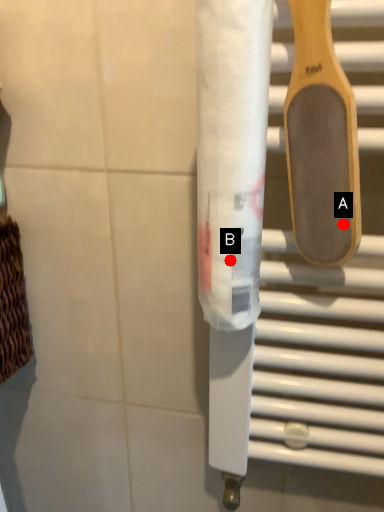
Question: Two points are circled on the image, labeled by A and B beside each circle. Which of the following is the closest to the observer?

Choices:
 (A) A is closer
 (B) B is closer

Answer: (A)